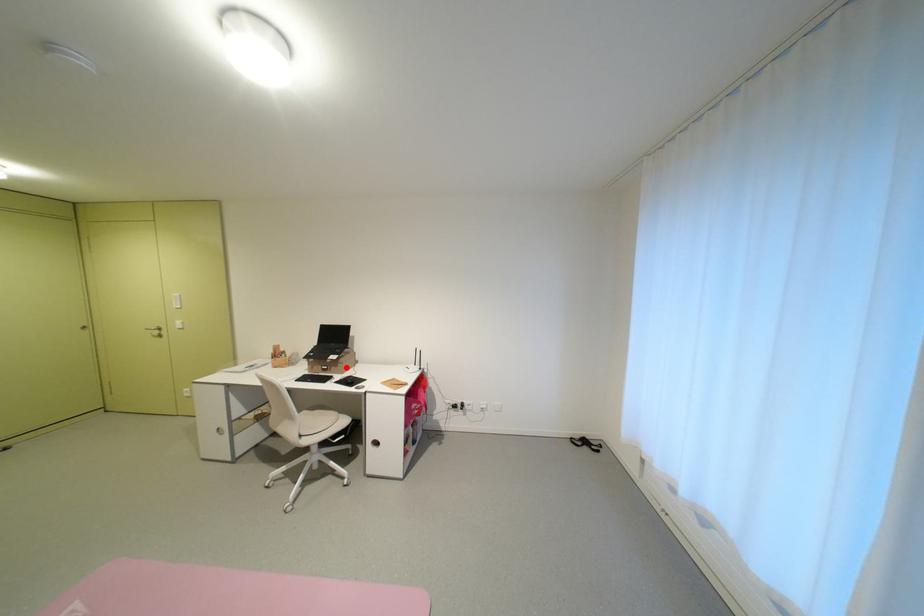
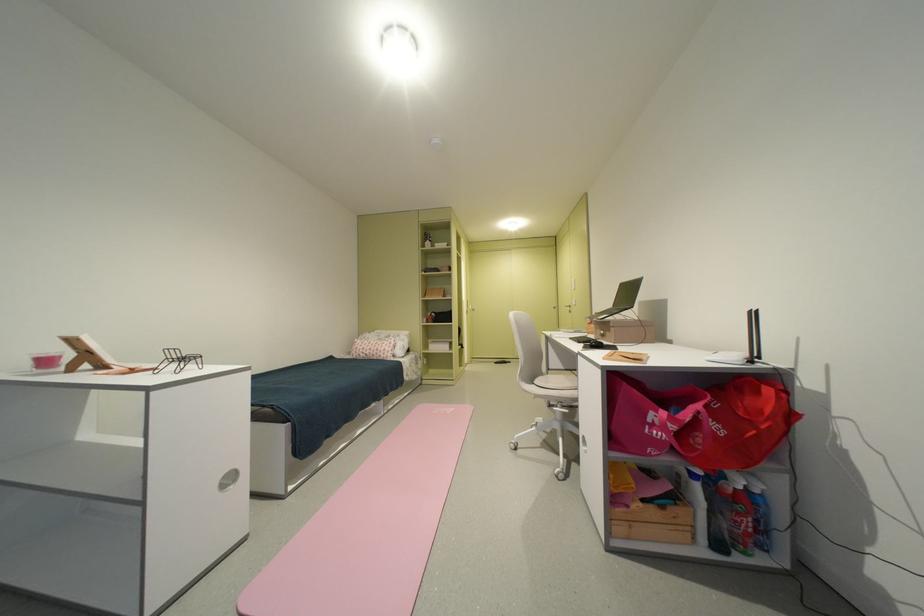
The point at the highlighted location is marked in the first image. Where is the corresponding point in the second image?

(618, 331)